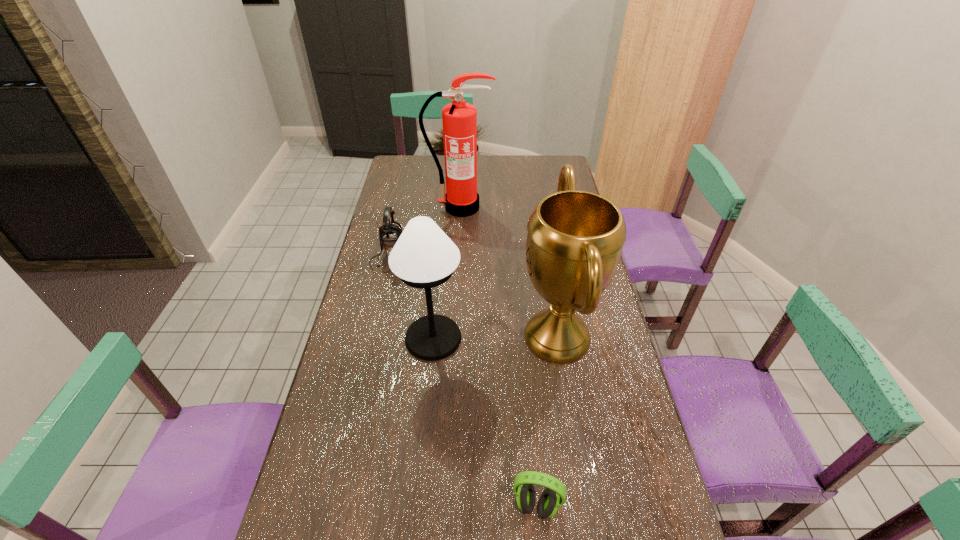
This screenshot has width=960, height=540. I want to click on vacant point located 0.170m on the surface of the trophy cup with symbols, so click(462, 337).

The image size is (960, 540). What are the coordinates of `blank space located on the front of the table lamp` in the screenshot? It's located at (421, 463).

I want to click on free location located on the right of the earphone, so click(x=488, y=260).

Find the location of `vacant space located on the back of the shortest object`. vacant space located on the back of the shortest object is located at coordinates (524, 366).

Image resolution: width=960 pixels, height=540 pixels. Find the location of `object that is at the left edge`. object that is at the left edge is located at coordinates (389, 233).

Identify the location of object at the right edge. The width and height of the screenshot is (960, 540). (575, 239).

Identify the location of free space at the far edge of the desktop. The width and height of the screenshot is (960, 540). click(498, 178).

In the image, there is a desktop. What are the coordinates of `vacant space at the left edge` in the screenshot? It's located at (383, 218).

You are a GUI agent. You are given a task and a screenshot of the screen. Output one action in this format:
    pyautogui.click(x=<x>, y=<y>)
    Task: Click on the vacant space at the right edge
    
    Given the screenshot: What is the action you would take?
    pyautogui.click(x=629, y=508)

Where is `vacant space at the far left corner of the desktop`? The image size is (960, 540). vacant space at the far left corner of the desktop is located at coordinates (422, 160).